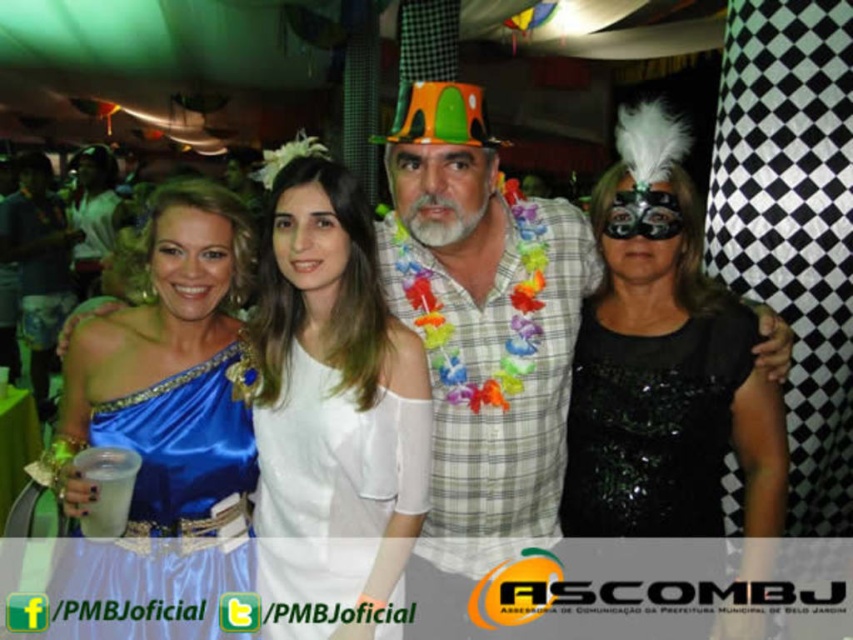
You are standing in the middle of the room and want to reach both the point at coordinates point (596, 355) and point (112, 577). Which point should you approach first to reach the closer one first?

You should approach point (596, 355) first because it is closer to you than point (112, 577), which is further away.

You are a photographer at the event and need to adjust the lighting to ensure both the white sheer dress at center and the blue satin dress at left are visible. Given their sizes, which dress might require more focused lighting to avoid being overshadowed?

The blue satin dress at left is smaller than the white sheer dress at center, so it might require more focused lighting to ensure it is adequately visible alongside the larger dress.